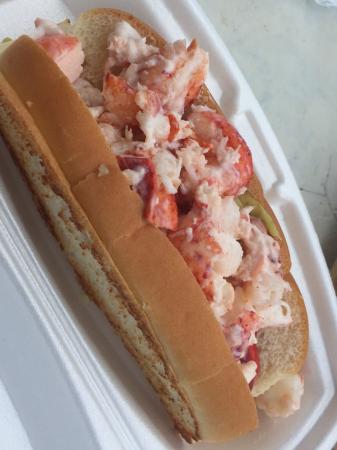
Locate an element on the screen. This screenshot has width=337, height=450. work top is located at coordinates (300, 60).